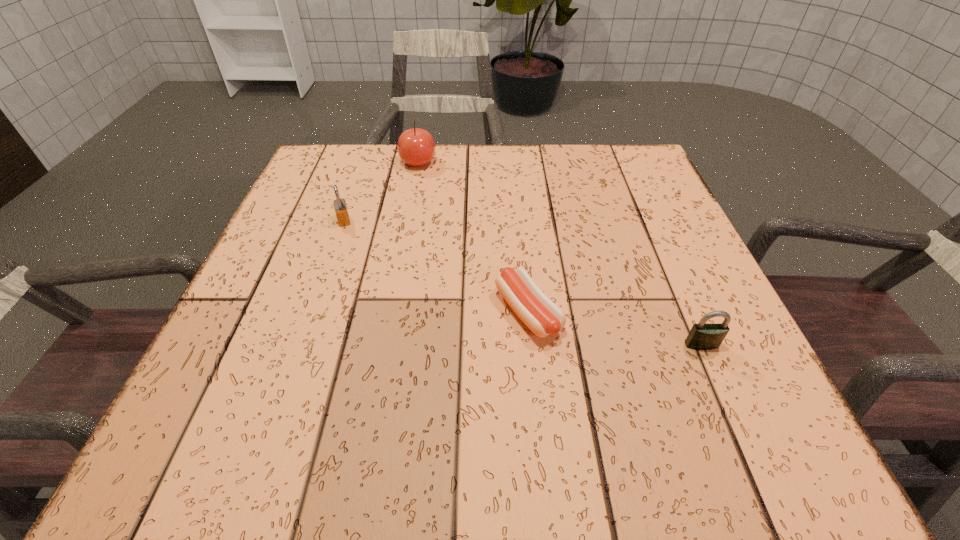
Locate an element on the screen. This screenshot has height=540, width=960. the tallest object is located at coordinates click(416, 147).

Where is `the farthest object`? Image resolution: width=960 pixels, height=540 pixels. the farthest object is located at coordinates (416, 147).

Identify the location of the leftmost object. The height and width of the screenshot is (540, 960). (341, 211).

The width and height of the screenshot is (960, 540). What are the coordinates of `the farther padlock` in the screenshot? It's located at pyautogui.click(x=341, y=211).

Find the location of a particular element. the rightmost object is located at coordinates (703, 336).

Locate an element on the screen. This screenshot has width=960, height=540. the nearer padlock is located at coordinates (703, 336).

Locate an element on the screen. the shortest object is located at coordinates (543, 317).

Identify the location of sausage. The height and width of the screenshot is (540, 960). (543, 317).

Locate an element on the screen. The width and height of the screenshot is (960, 540). free space located on the front of the second object from left to right is located at coordinates (398, 267).

In order to click on free location located on the right of the left padlock in this screenshot , I will do `click(486, 220)`.